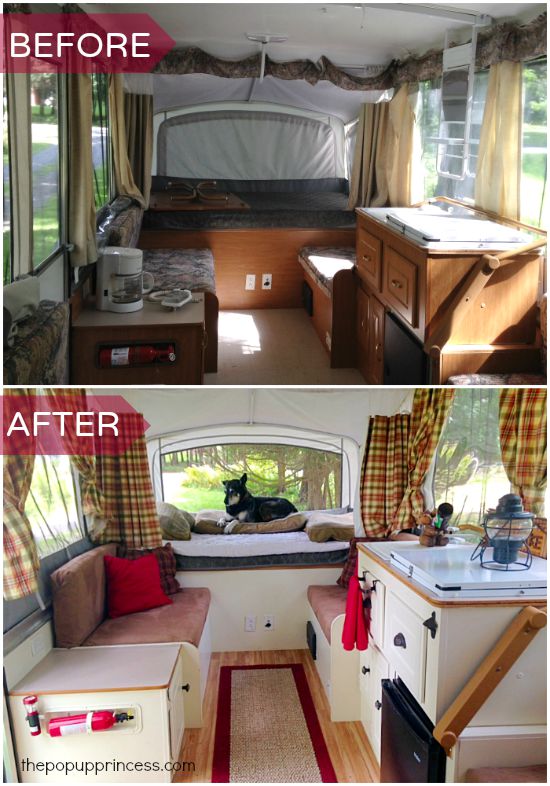
Identify the location of red pillow. The height and width of the screenshot is (786, 550). point(141,593).